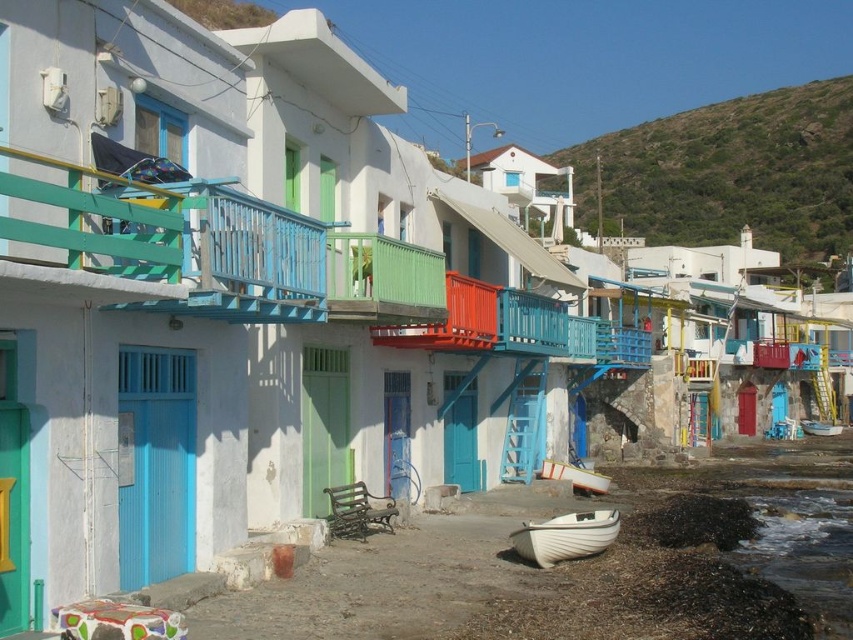
You are a tourist visiting the coastal village and want to take a photo of both the white matte boat at lower center and the white plastic boat at lower right. Which boat should you stand closer to in order to capture both in the same frame?

You should stand closer to the white matte boat at lower center because it is in front of the white plastic boat at lower right, so positioning yourself closer to the front boat will help include both in the frame.

You are a tourist in the coastal village and want to take a photo of both the white matte boat at lower center and the white plastic boat at lower right. Which boat should you stand closer to if you want both boats to be visible in your photo?

You should stand closer to the white plastic boat at lower right because the white matte boat at lower center is to the left of it, so positioning yourself near the right boat will help capture both in the frame.